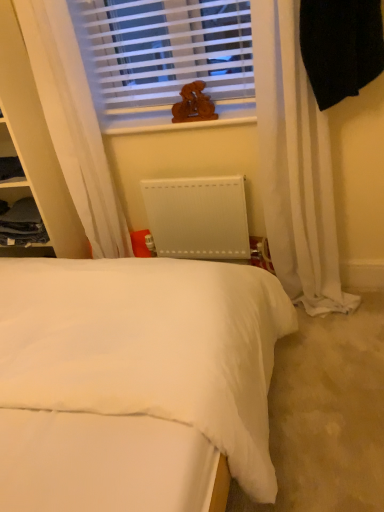
Image resolution: width=384 pixels, height=512 pixels. Describe the element at coordinates (135, 381) in the screenshot. I see `white soft bed at center` at that location.

Where is `white sheer curtain at upper left`? The width and height of the screenshot is (384, 512). white sheer curtain at upper left is located at coordinates (73, 123).

This screenshot has width=384, height=512. I want to click on white plastic blinds at upper center, so click(x=163, y=56).

The width and height of the screenshot is (384, 512). What do you see at coordinates (22, 224) in the screenshot? I see `dark gray fabric cabinet at left` at bounding box center [22, 224].

Measure the distance between dark gray fabric cabinet at left and camera.

They are 6.97 feet apart.

You are a GUI agent. You are given a task and a screenshot of the screen. Output one action in this format:
    pyautogui.click(x=<x>, y=<y>)
    Task: Click on the white soft bed at center
    The height and width of the screenshot is (512, 384).
    Given the screenshot: What is the action you would take?
    pyautogui.click(x=135, y=381)

In the image, is wooden carving at upper center on the left side or the right side of white plastic blinds at upper center?

Based on their positions, wooden carving at upper center is located to the right of white plastic blinds at upper center.

Locate an element on the screen. The image size is (384, 512). window sill located on the right of white plastic blinds at upper center is located at coordinates (180, 121).

Is point (232, 116) closer to camera compared to point (146, 76)?

Yes.

Is there a large distance between dark gray fabric cabinet at left and white soft bed at center?

No, dark gray fabric cabinet at left is in close proximity to white soft bed at center.

What's the angular difference between dark gray fabric cabinet at left and white soft bed at center's facing directions?

The angle between the facing direction of dark gray fabric cabinet at left and the facing direction of white soft bed at center is 85.2 degrees.

Between dark gray fabric cabinet at left and white soft bed at center, which one is positioned behind?

dark gray fabric cabinet at left is further away from the camera.

Measure the distance from dark gray fabric cabinet at left to white soft bed at center.

dark gray fabric cabinet at left is 38.99 inches away from white soft bed at center.

This screenshot has height=512, width=384. I want to click on radiator behind the wooden carving at upper center, so click(x=198, y=217).

Is wooden carving at upper center shorter than white matte radiator at center?

Yes.

Based on the photo, from a real-world perspective, is wooden carving at upper center positioned over white matte radiator at center based on gravity?

Yes.

Is the position of wooden carving at upper center less distant than that of white matte radiator at center?

Yes, the depth of wooden carving at upper center is less than that of white matte radiator at center.

From the image's perspective, is dark gray fabric cabinet at left located above wooden carving at upper center?

Incorrect, from the image's perspective, dark gray fabric cabinet at left is lower than wooden carving at upper center.

Is point (26, 239) less distant than point (252, 119)?

That is False.

Can you confirm if dark gray fabric cabinet at left is bigger than wooden carving at upper center?

Yes, dark gray fabric cabinet at left is bigger than wooden carving at upper center.

Identify the location of window sill on the right of dark gray fabric cabinet at left. (180, 121).

Considering the positions of point (227, 103) and point (14, 226), is point (227, 103) closer or farther from the camera than point (14, 226)?

Point (227, 103) is positioned closer to the camera compared to point (14, 226).

How many degrees apart are the facing directions of white plastic blinds at upper center and dark gray fabric cabinet at left?

white plastic blinds at upper center and dark gray fabric cabinet at left are facing 5.43 degrees away from each other.

You are a GUI agent. You are given a task and a screenshot of the screen. Output one action in this format:
    pyautogui.click(x=<x>, y=<y>)
    Task: Click on the window blind in front of the dark gray fabric cabinet at left
    
    Given the screenshot: What is the action you would take?
    pyautogui.click(x=163, y=56)

Is wooden carving at upper center at the back of white sheer curtain at upper left?

white sheer curtain at upper left does not have its back to wooden carving at upper center.

From a real-world perspective, is white sheer curtain at upper left located higher than wooden carving at upper center?

No, from a real-world perspective, white sheer curtain at upper left is not over wooden carving at upper center

Is white sheer curtain at upper left next to wooden carving at upper center?

No, white sheer curtain at upper left is not in contact with wooden carving at upper center.

Is white sheer curtain at upper left at the left side of wooden carving at upper center?

Indeed, white sheer curtain at upper left is positioned on the left side of wooden carving at upper center.

Which of these two, white matte radiator at center or dark gray fabric cabinet at left, is thinner?

white matte radiator at center.

Based on their positions, is white matte radiator at center located to the left or right of dark gray fabric cabinet at left?

In the image, white matte radiator at center appears on the right side of dark gray fabric cabinet at left.

How far apart are white matte radiator at center and dark gray fabric cabinet at left?

white matte radiator at center is 29.36 inches away from dark gray fabric cabinet at left.

What's the angular difference between white matte radiator at center and dark gray fabric cabinet at left's facing directions?

6.07 degrees separate the facing orientations of white matte radiator at center and dark gray fabric cabinet at left.

You are a GUI agent. You are given a task and a screenshot of the screen. Output one action in this format:
    pyautogui.click(x=<x>, y=<y>)
    Task: Click on the window sill behind the white plastic blinds at upper center
    The image size is (384, 512).
    Given the screenshot: What is the action you would take?
    pyautogui.click(x=180, y=121)

Identify the location of bed on the right of dark gray fabric cabinet at left. (135, 381).

When comparing their distances from white sheer curtain at upper left, does white soft bed at center or wooden carving at upper center seem further?

white soft bed at center is further to white sheer curtain at upper left.

From the image, which object appears to be nearer to white matte radiator at center, white soft bed at center or white plastic blinds at upper center?

Among the two, white plastic blinds at upper center is located nearer to white matte radiator at center.

From the image, which object appears to be nearer to white sheer curtain at upper left, white matte radiator at center or dark gray fabric cabinet at left?

white matte radiator at center lies closer to white sheer curtain at upper left than the other object.

Which object lies further to the anchor point white sheer curtain at upper left, dark gray fabric cabinet at left or white matte radiator at center?

dark gray fabric cabinet at left.

From the image, which object appears to be nearer to dark gray fabric cabinet at left, white soft bed at center or wooden carving at upper center?

Among the two, wooden carving at upper center is located nearer to dark gray fabric cabinet at left.

Looking at the image, which one is located further to wooden carving at upper center, white sheer curtain at upper left or white plastic blinds at upper center?

white sheer curtain at upper left is positioned further to the anchor wooden carving at upper center.

Looking at the image, which one is located closer to white matte radiator at center, white plastic blinds at upper center or dark gray fabric cabinet at left?

white plastic blinds at upper center is positioned closer to the anchor white matte radiator at center.

Consider the image. From the image, which object appears to be nearer to white plastic blinds at upper center, white matte radiator at center or white soft bed at center?

Based on the image, white matte radiator at center appears to be nearer to white plastic blinds at upper center.

The height and width of the screenshot is (512, 384). What are the coordinates of `window sill between white plastic blinds at upper center and white soft bed at center from top to bottom` in the screenshot? It's located at (180, 121).

Locate an element on the screen. The image size is (384, 512). window sill between dark gray fabric cabinet at left and white matte radiator at center in the horizontal direction is located at coordinates (180, 121).

Locate an element on the screen. The width and height of the screenshot is (384, 512). radiator between white sheer curtain at upper left and white soft bed at center from top to bottom is located at coordinates (198, 217).

Identify the location of radiator between wooden carving at upper center and white soft bed at center from top to bottom. (198, 217).